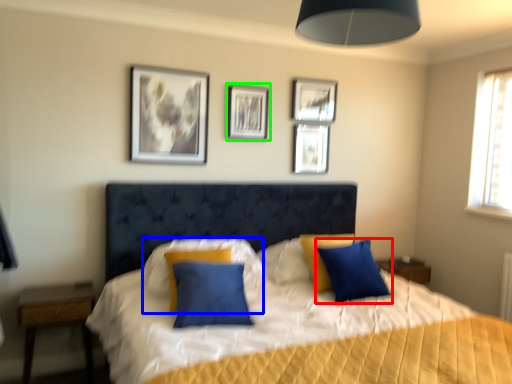
Question: Which object is the farthest from pillow (highlighted by a red box)? Choose among these: pillow (highlighted by a blue box) or picture frame (highlighted by a green box).

Choices:
 (A) pillow
 (B) picture frame

Answer: (B)